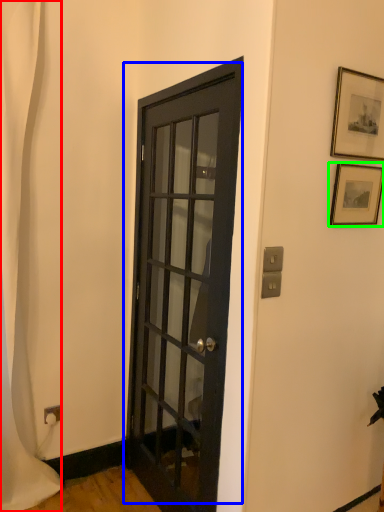
Question: Which object is positioned farthest from shower curtain (highlighted by a red box)? Select from door (highlighted by a blue box) and picture frame (highlighted by a green box).

Choices:
 (A) door
 (B) picture frame

Answer: (B)